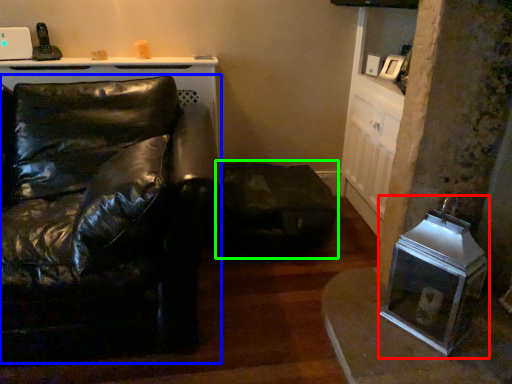
Question: Considering the real-world distances, which object is closest to appliance (highlighted by a red box)? studio couch (highlighted by a blue box) or swivel chair (highlighted by a green box).

Choices:
 (A) studio couch
 (B) swivel chair

Answer: (B)